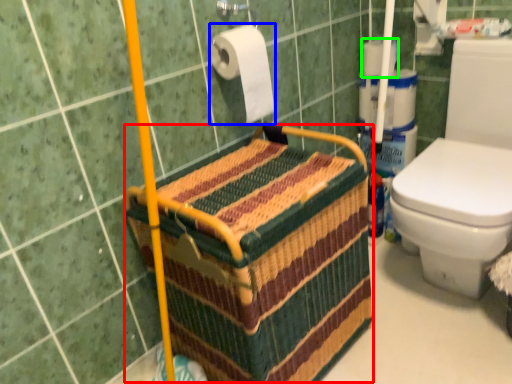
Question: Which is nearer to the basket (highlighted by a red box)? toilet paper (highlighted by a blue box) or toilet paper (highlighted by a green box).

Choices:
 (A) toilet paper
 (B) toilet paper

Answer: (A)